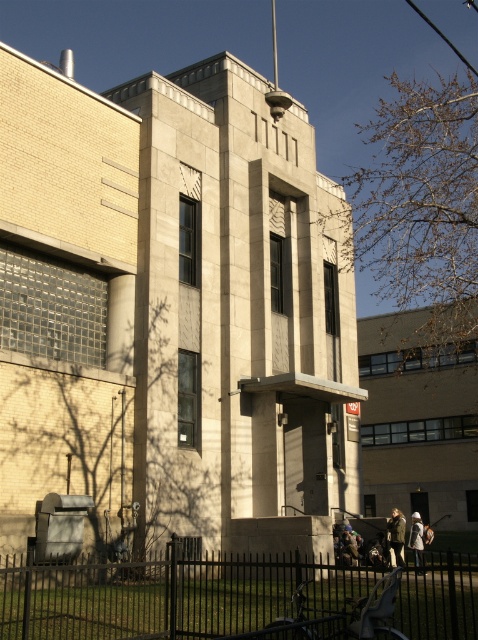
Is camouflage jacket at lower right smaller than white cotton coat at lower right?

Correct, camouflage jacket at lower right occupies less space than white cotton coat at lower right.

Which is behind, point (389, 540) or point (419, 518)?

Point (419, 518)

You are a GUI agent. You are given a task and a screenshot of the screen. Output one action in this format:
    pyautogui.click(x=<x>, y=<y>)
    Task: Click on the camouflage jacket at lower right
    
    Given the screenshot: What is the action you would take?
    pyautogui.click(x=395, y=538)

Does black metal fence at lower center appear on the right side of camouflage jacket at lower right?

No, black metal fence at lower center is not to the right of camouflage jacket at lower right.

Between point (205, 589) and point (393, 532), which one is positioned behind?

Positioned behind is point (393, 532).

The width and height of the screenshot is (478, 640). I want to click on black metal fence at lower center, so click(x=176, y=596).

Where is `black metal fence at lower center`? The width and height of the screenshot is (478, 640). black metal fence at lower center is located at coordinates click(176, 596).

Does black metal fence at lower center appear on the left side of white cotton coat at lower right?

Correct, you'll find black metal fence at lower center to the left of white cotton coat at lower right.

Between black metal fence at lower center and white cotton coat at lower right, which one is positioned lower?

white cotton coat at lower right

What are the coordinates of `black metal fence at lower center` in the screenshot? It's located at (176, 596).